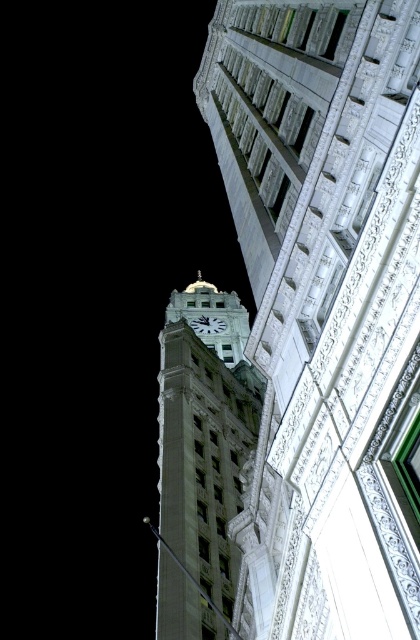
You are standing in front of the building and want to locate the white stone clock tower at center. According to the coordinates given, where should you look?

You should look at point (204, 433) to find the white stone clock tower at center.

You are standing in front of a building with a clock tower. You see a point marked at coordinates (x=325, y=305). What does this point indicate?

The point at coordinates (x=325, y=305) indicates the green copper clock tower at left.

You are standing in front of the tall ornate building and want to take a photo of the green copper clock tower at left. Based on the scene description, where should you position your camera to capture the clock tower in the frame?

The green copper clock tower at left is located at point (325,305) in the 2D image plane, so position your camera to aim towards that coordinate to capture it in the frame.